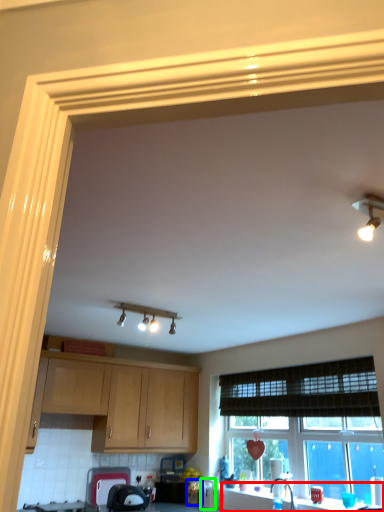
Question: Which object is the farthest from counter top (highlighted by a red box)? Choose among these: appliance (highlighted by a blue box) or appliance (highlighted by a green box).

Choices:
 (A) appliance
 (B) appliance

Answer: (A)